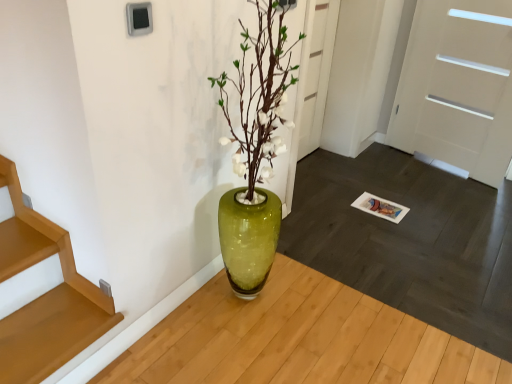
Question: In the image, is white matte door at center, positioned as the 1th door in left-to-right order, on the left side or the right side of white glossy door at right, which is the second door from left to right?

Choices:
 (A) right
 (B) left

Answer: (B)

Question: Considering the positions of white matte door at center, positioned as the 1th door in left-to-right order, and white glossy door at right, which is the second door from left to right, in the image, is white matte door at center, positioned as the 1th door in left-to-right order, bigger or smaller than white glossy door at right, which is the second door from left to right,?

Choices:
 (A) big
 (B) small

Answer: (B)

Question: From a real-world perspective, is white matte door at center, the 2th door when ordered from right to left, positioned above or below white glossy door at right, which is the second door from left to right?

Choices:
 (A) above
 (B) below

Answer: (B)

Question: Based on their positions, is white glossy door at right, the first door positioned from the right, located to the left or right of white matte door at center, the 2th door when ordered from right to left?

Choices:
 (A) left
 (B) right

Answer: (B)

Question: Is white glossy door at right, which is the second door from left to right, inside or outside of white matte door at center, positioned as the 1th door in left-to-right order?

Choices:
 (A) outside
 (B) inside

Answer: (A)

Question: From a real-world perspective, is white glossy door at right, which is the second door from left to right, positioned above or below white matte door at center, positioned as the 1th door in left-to-right order?

Choices:
 (A) above
 (B) below

Answer: (A)

Question: Is point (477, 59) positioned closer to the camera than point (310, 150)?

Choices:
 (A) closer
 (B) farther

Answer: (A)